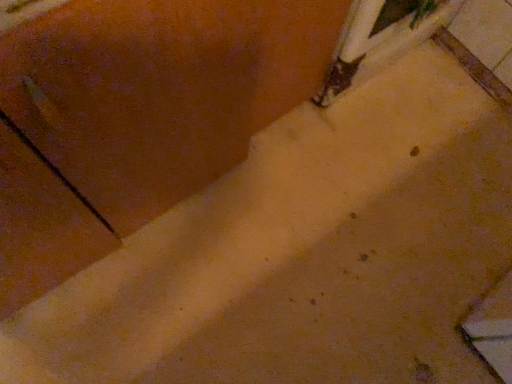
Image resolution: width=512 pixels, height=384 pixels. I want to click on matte wood door at upper left, so click(x=159, y=90).

Describe the element at coordinates (159, 90) in the screenshot. I see `matte wood door at upper left` at that location.

Find the location of a particular element. Image resolution: width=512 pixels, height=384 pixels. matte wood door at upper left is located at coordinates (159, 90).